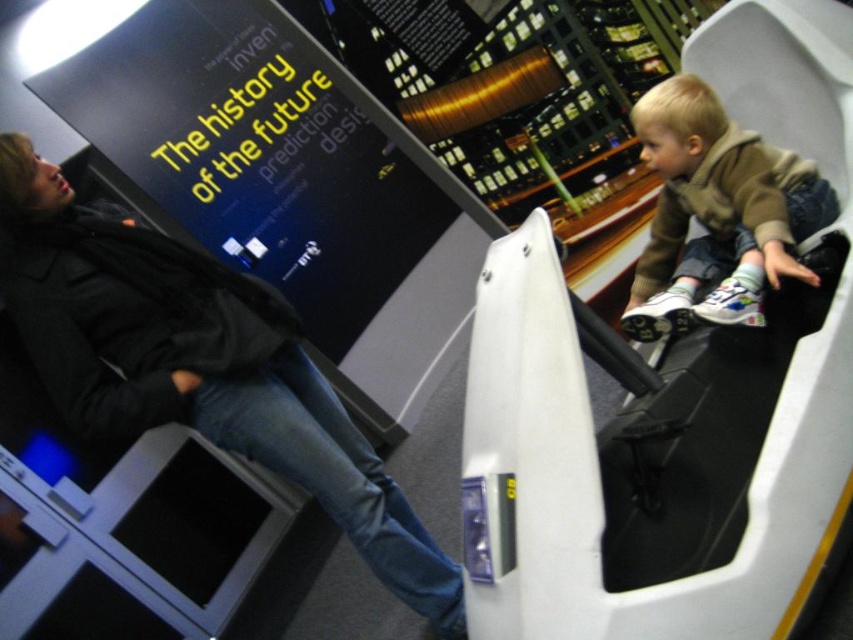
Question: Does dark gray jacket at upper left have a greater width compared to light brown fleece jacket at upper right?

Choices:
 (A) yes
 (B) no

Answer: (A)

Question: Among these points, which one is farthest from the camera?

Choices:
 (A) (709, 284)
 (B) (212, 333)

Answer: (A)

Question: Is dark gray jacket at upper left positioned behind light brown fleece jacket at upper right?

Choices:
 (A) yes
 (B) no

Answer: (B)

Question: Is dark gray jacket at upper left further to the viewer compared to light brown fleece jacket at upper right?

Choices:
 (A) no
 (B) yes

Answer: (A)